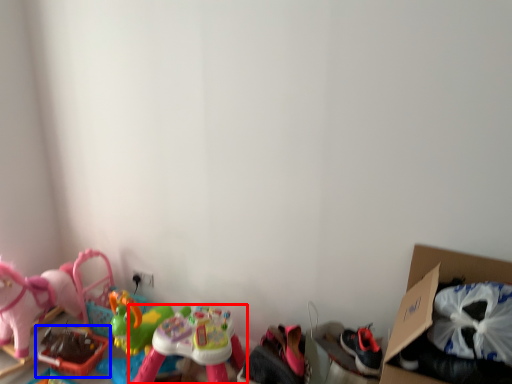
Question: Among these objects, which one is farthest to the camera, toy (highlighted by a red box) or toy (highlighted by a blue box)?

Choices:
 (A) toy
 (B) toy

Answer: (B)